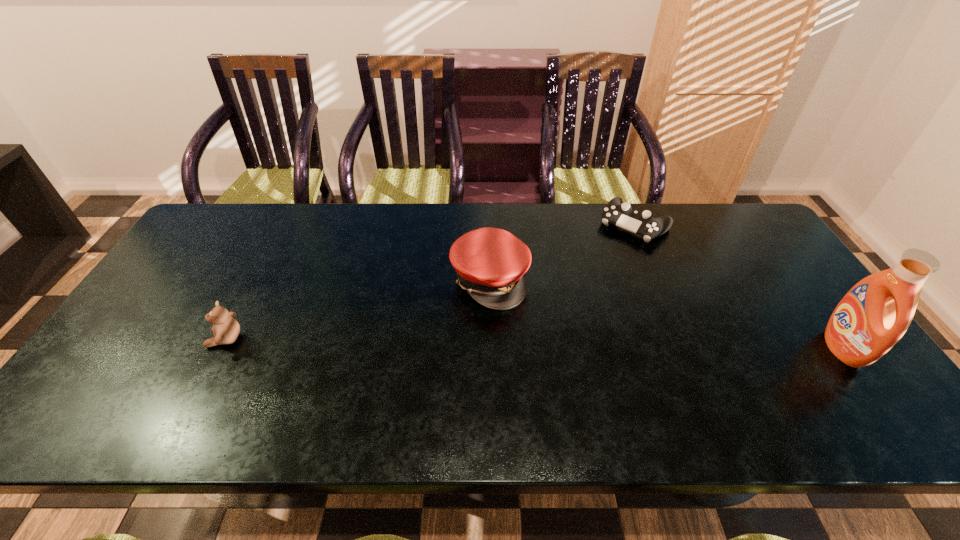
At what (x,y) coordinates should I click in order to perform the action: click on teddy bear. Please return your answer as a coordinate pair (x, y). This screenshot has width=960, height=540. Looking at the image, I should click on (226, 329).

At what (x,y) coordinates should I click in order to perform the action: click on the tallest object. Please return your answer as a coordinate pair (x, y). Looking at the image, I should click on (872, 317).

The width and height of the screenshot is (960, 540). In order to click on the rightmost object in this screenshot , I will do `click(872, 317)`.

At what (x,y) coordinates should I click in order to perform the action: click on the second object from left to right. Please return your answer as a coordinate pair (x, y). Looking at the image, I should click on (490, 263).

The image size is (960, 540). Identify the location of the third nearest object. (490, 263).

Where is `the third object from left to right`? the third object from left to right is located at coordinates (620, 214).

Identify the location of the farthest object. (620, 214).

I want to click on vacant space located 0.120m on the front-facing side of the leftmost object, so pyautogui.click(x=162, y=339).

You are a GUI agent. You are given a task and a screenshot of the screen. Output one action in this format:
    pyautogui.click(x=<x>, y=<y>)
    Task: Click on the blank space located 0.100m on the front-facing side of the leftmost object
    Image resolution: width=960 pixels, height=540 pixels.
    Given the screenshot: What is the action you would take?
    pyautogui.click(x=170, y=339)

Locate an element on the screen. blank area located 0.050m on the front-facing side of the leftmost object is located at coordinates (190, 339).